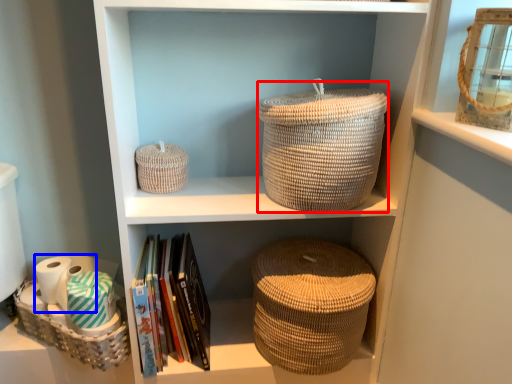
Question: Which object is further to the camera taking this photo, basket (highlighted by a red box) or toilet paper (highlighted by a blue box)?

Choices:
 (A) basket
 (B) toilet paper

Answer: (B)